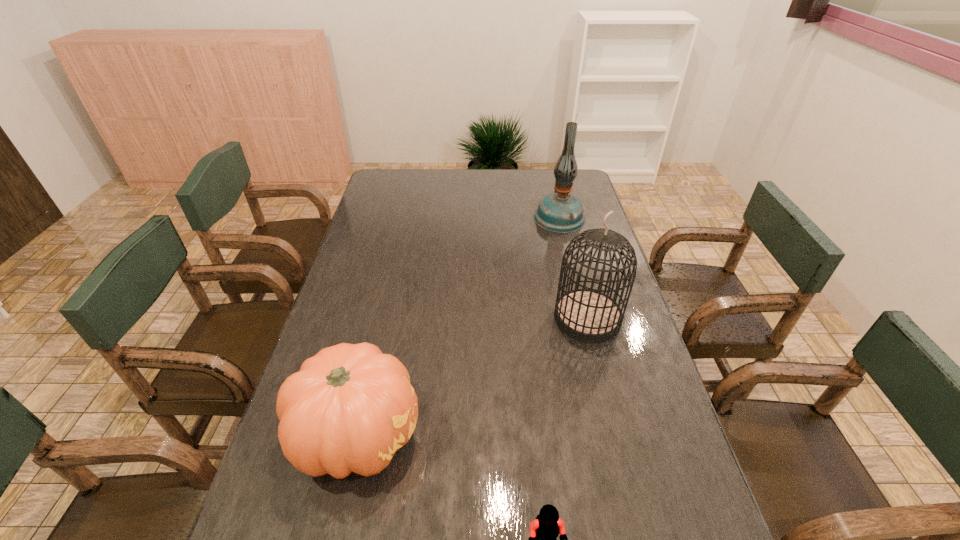
Identify the location of free space at the far edge of the desktop. The image size is (960, 540). (540, 185).

Image resolution: width=960 pixels, height=540 pixels. In the image, there is a desktop. Identify the location of free region at the left edge. (394, 219).

At what (x,y) coordinates should I click in order to perform the action: click on free space at the right edge. Please return your answer as a coordinate pair (x, y). The image size is (960, 540). Looking at the image, I should click on (624, 401).

In order to click on free space at the far left corner of the desktop in this screenshot , I will do `click(381, 187)`.

I want to click on free space at the far right corner of the desktop, so click(x=573, y=194).

Image resolution: width=960 pixels, height=540 pixels. In order to click on free point between the farthest object and the leftmost object in this screenshot , I will do (459, 326).

The width and height of the screenshot is (960, 540). In order to click on empty space between the pumpkin and the birdcage in this screenshot , I will do `click(472, 376)`.

The height and width of the screenshot is (540, 960). I want to click on the third closest object relative to the pumpkin, so click(x=560, y=212).

Find the location of a particular element. The image size is (960, 540). object identified as the second closest to the second shortest object is located at coordinates (588, 315).

Identify the location of vacant area in the image that satisfies the following two spatial constraints: 1. on the front side of the birdcage; 2. on the carved face of the third farthest object. (616, 434).